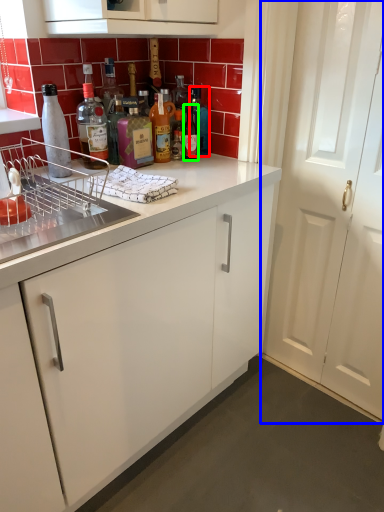
Question: Which is farther away from bottle (highlighted by a red box)? door (highlighted by a blue box) or bottle (highlighted by a green box)?

Choices:
 (A) door
 (B) bottle

Answer: (A)